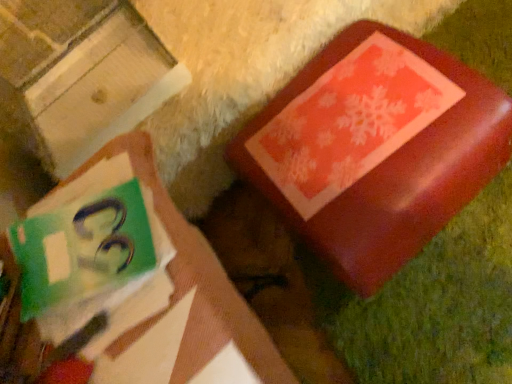
Question: Is matte green book at upper left not within matte red box at upper right?

Choices:
 (A) yes
 (B) no

Answer: (A)

Question: Does matte green book at upper left have a lesser height compared to matte red box at upper right?

Choices:
 (A) yes
 (B) no

Answer: (B)

Question: Is matte green book at upper left smaller than matte red box at upper right?

Choices:
 (A) yes
 (B) no

Answer: (B)

Question: Is matte green book at upper left at the left side of matte red box at upper right?

Choices:
 (A) yes
 (B) no

Answer: (B)

Question: Is matte green book at upper left touching matte red box at upper right?

Choices:
 (A) yes
 (B) no

Answer: (B)

Question: Is matte green book at upper left looking in the opposite direction of matte red box at upper right?

Choices:
 (A) no
 (B) yes

Answer: (A)

Question: Is matte red box at upper right taller than shiny red box at upper right?

Choices:
 (A) yes
 (B) no

Answer: (A)

Question: Would you say matte red box at upper right is outside shiny red box at upper right?

Choices:
 (A) no
 (B) yes

Answer: (B)

Question: From the image's perspective, would you say matte red box at upper right is shown under shiny red box at upper right?

Choices:
 (A) no
 (B) yes

Answer: (A)

Question: From the image's perspective, is matte red box at upper right on shiny red box at upper right?

Choices:
 (A) no
 (B) yes

Answer: (B)

Question: Is matte red box at upper right turned away from shiny red box at upper right?

Choices:
 (A) yes
 (B) no

Answer: (B)

Question: Does matte red box at upper right contain shiny red box at upper right?

Choices:
 (A) no
 (B) yes

Answer: (A)

Question: Is matte green book at upper left oriented away from shiny red box at upper right?

Choices:
 (A) no
 (B) yes

Answer: (A)